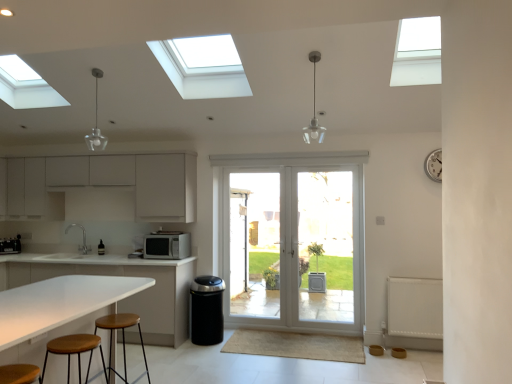
Question: Is satin nickel faucet at center not inside white textured radiator at lower right?

Choices:
 (A) yes
 (B) no

Answer: (A)

Question: Considering the relative sizes of satin nickel faucet at center and white textured radiator at lower right in the image provided, is satin nickel faucet at center shorter than white textured radiator at lower right?

Choices:
 (A) yes
 (B) no

Answer: (A)

Question: Is the depth of satin nickel faucet at center greater than that of white textured radiator at lower right?

Choices:
 (A) no
 (B) yes

Answer: (B)

Question: Does satin nickel faucet at center have a lesser width compared to white textured radiator at lower right?

Choices:
 (A) no
 (B) yes

Answer: (A)

Question: From the image's perspective, is satin nickel faucet at center below white textured radiator at lower right?

Choices:
 (A) yes
 (B) no

Answer: (B)

Question: Considering the relative sizes of satin nickel faucet at center and white textured radiator at lower right in the image provided, is satin nickel faucet at center wider than white textured radiator at lower right?

Choices:
 (A) yes
 (B) no

Answer: (A)

Question: Can you confirm if white matte cabinets at left, the first cabinetry from the top, is wider than white laminate table at lower left?

Choices:
 (A) yes
 (B) no

Answer: (B)

Question: Is white matte cabinets at left, acting as the second cabinetry starting from the bottom, further to the viewer compared to white laminate table at lower left?

Choices:
 (A) no
 (B) yes

Answer: (B)

Question: Can you confirm if white matte cabinets at left, acting as the second cabinetry starting from the bottom, is thinner than white laminate table at lower left?

Choices:
 (A) yes
 (B) no

Answer: (A)

Question: Is white matte cabinets at left, acting as the second cabinetry starting from the bottom, not close to white laminate table at lower left?

Choices:
 (A) yes
 (B) no

Answer: (A)

Question: Considering the relative positions of white matte cabinets at left, acting as the second cabinetry starting from the bottom, and white laminate table at lower left in the image provided, is white matte cabinets at left, acting as the second cabinetry starting from the bottom, to the left of white laminate table at lower left from the viewer's perspective?

Choices:
 (A) yes
 (B) no

Answer: (A)

Question: Can you confirm if white matte cabinets at left, the first cabinetry from the top, is shorter than white laminate table at lower left?

Choices:
 (A) yes
 (B) no

Answer: (A)

Question: Does clear glass door at center have a greater width compared to brown wood stool at lower left, which ranks as the 1th stool in front-to-back order?

Choices:
 (A) yes
 (B) no

Answer: (B)